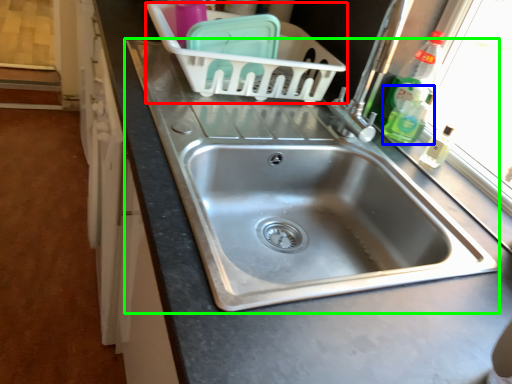
Question: Considering the real-world distances, which object is farthest from basket (highlighted by a red box)? bottle (highlighted by a blue box) or sink (highlighted by a green box)?

Choices:
 (A) bottle
 (B) sink

Answer: (A)